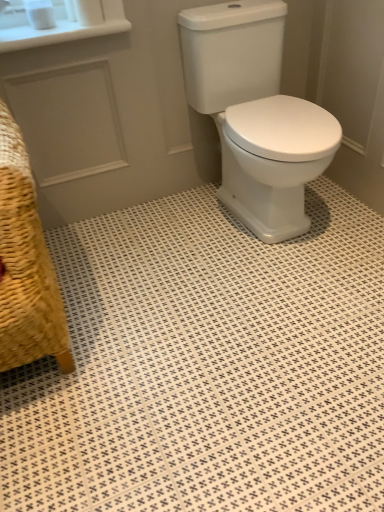
You are a GUI agent. You are given a task and a screenshot of the screen. Output one action in this format:
    pyautogui.click(x=<x>, y=<y>)
    Task: Click on the free point to the right of white glossy porcelain at center
    The width and height of the screenshot is (384, 512).
    Given the screenshot: What is the action you would take?
    pyautogui.click(x=340, y=213)